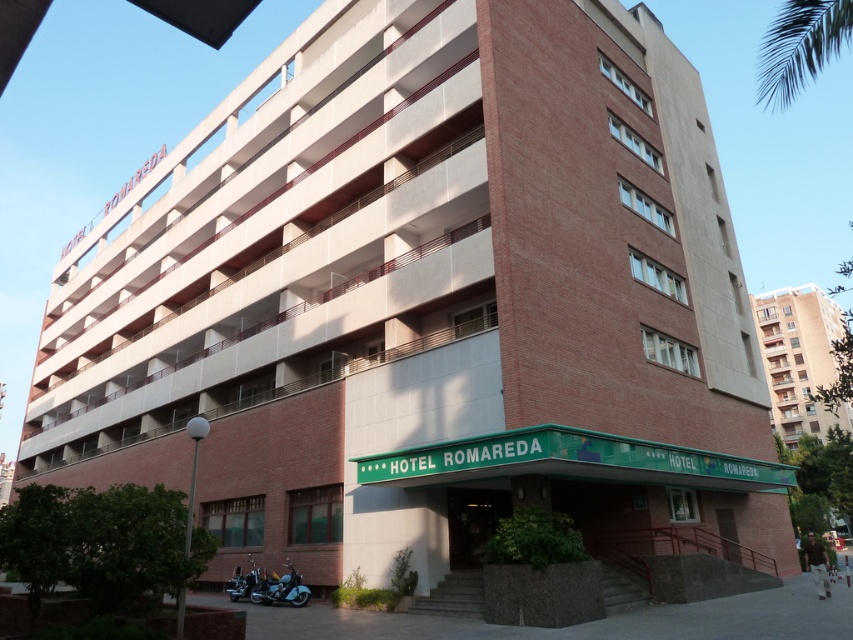
Question: Is shiny chrome motorcycle at lower center positioned behind shiny chrome motorcycle at lower left?

Choices:
 (A) yes
 (B) no

Answer: (B)

Question: Is brown brick building at right in front of shiny chrome motorcycle at lower left?

Choices:
 (A) no
 (B) yes

Answer: (A)

Question: Which of the following is the farthest from the observer?

Choices:
 (A) (798, 22)
 (B) (254, 580)
 (C) (827, 321)
 (D) (288, 588)

Answer: (C)

Question: Which point is farther to the camera?

Choices:
 (A) shiny chrome motorcycle at lower center
 (B) shiny chrome motorcycle at lower left
 (C) green leafy palm tree at upper right

Answer: (B)

Question: Is brown brick building at right below shiny chrome motorcycle at lower left?

Choices:
 (A) no
 (B) yes

Answer: (A)

Question: Based on their relative distances, which object is farther from the green leafy palm tree at upper right?

Choices:
 (A) shiny chrome motorcycle at lower center
 (B) brown brick building at right
 (C) shiny chrome motorcycle at lower left

Answer: (B)